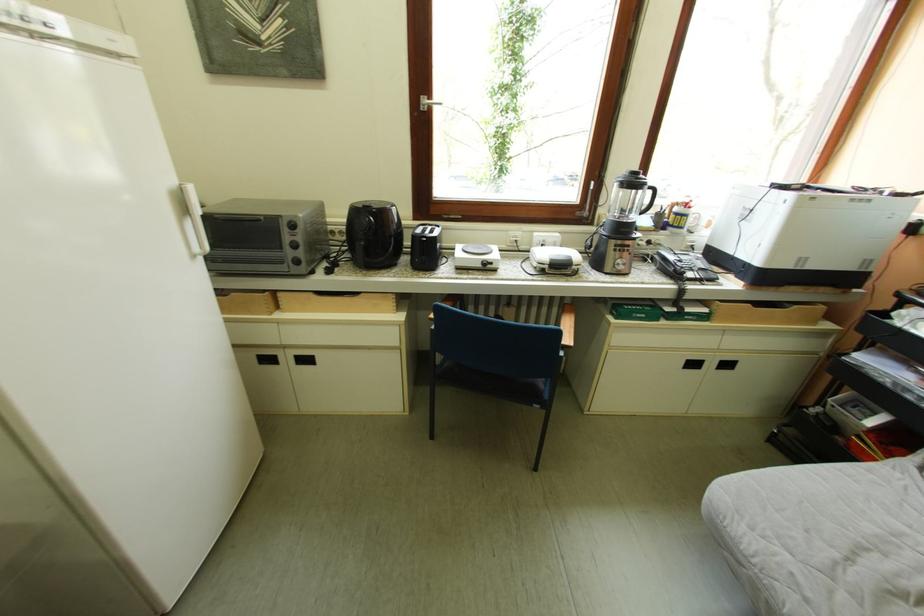
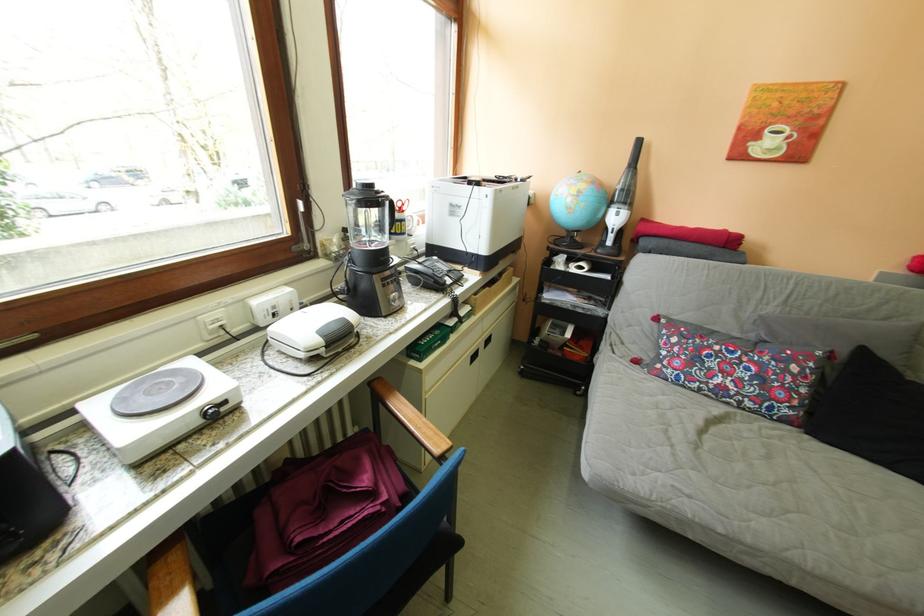
Question: The camera is either moving clockwise (left) or counter-clockwise (right) around the object. The first image is from the beginning of the video and the second image is from the end. Is the camera moving left or right when shooting the video?

Choices:
 (A) Left
 (B) Right

Answer: (A)